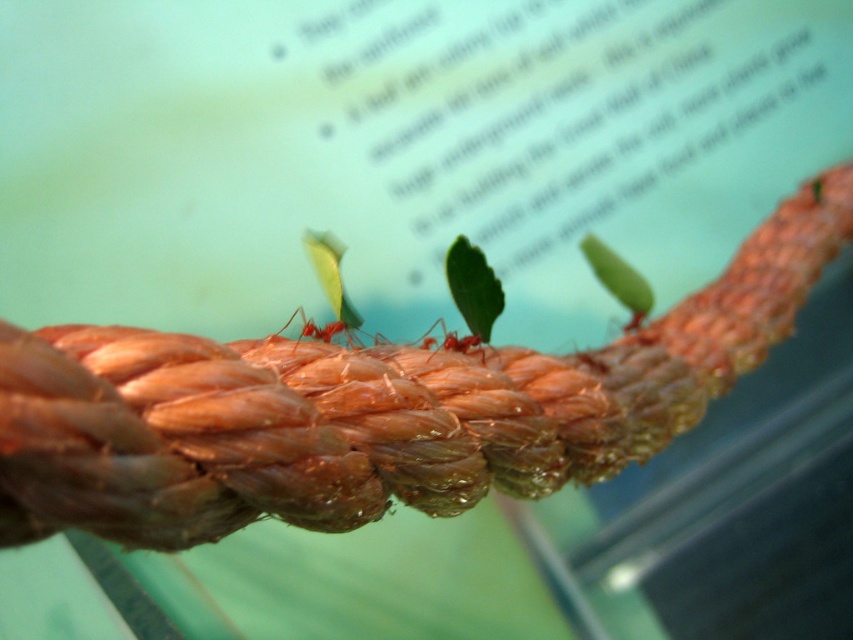
Question: Can you confirm if matte red ant at center is positioned to the left of red matte ant at center?

Choices:
 (A) no
 (B) yes

Answer: (B)

Question: Among these points, which one is nearest to the camera?

Choices:
 (A) (289, 317)
 (B) (421, 340)

Answer: (A)

Question: Does matte red ant at center appear over red matte ant at center?

Choices:
 (A) yes
 (B) no

Answer: (A)

Question: Which of the following is the closest to the observer?

Choices:
 (A) (350, 323)
 (B) (450, 340)

Answer: (A)

Question: Which point is closer to the camera taking this photo?

Choices:
 (A) (462, 352)
 (B) (347, 317)

Answer: (B)

Question: Is matte red ant at center positioned in front of red matte ant at center?

Choices:
 (A) yes
 (B) no

Answer: (A)